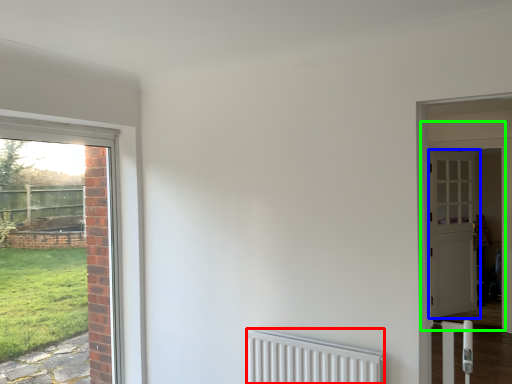
Question: Based on their relative distances, which object is farther from radiator (highlighted by a red box)? Choose from door (highlighted by a blue box) and door (highlighted by a green box).

Choices:
 (A) door
 (B) door

Answer: (A)